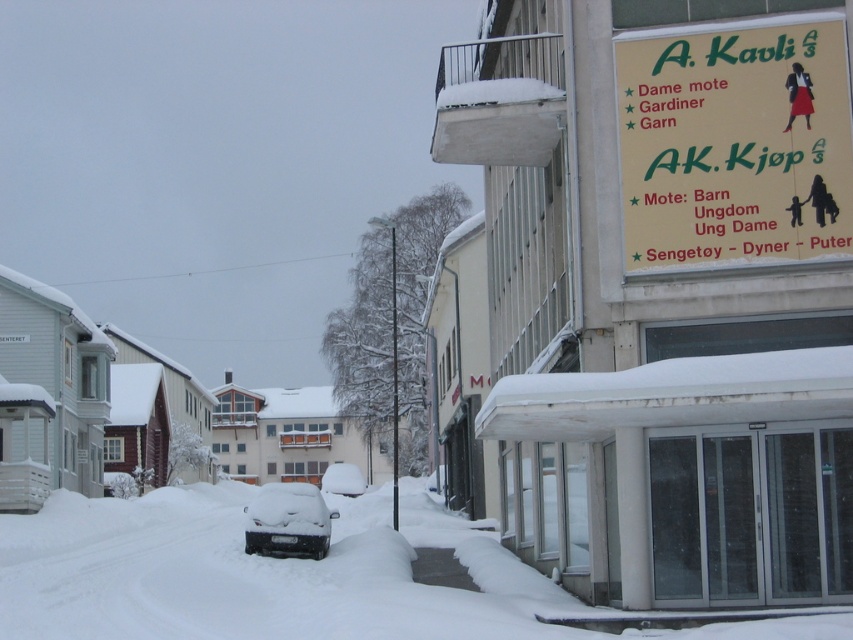
Question: Is yellow paper sign at upper right in front of snow-covered car at center?

Choices:
 (A) no
 (B) yes

Answer: (B)

Question: Among these objects, which one is nearest to the camera?

Choices:
 (A) snow-covered car at center
 (B) yellow paper sign at upper right

Answer: (B)

Question: Does yellow paper sign at upper right have a larger size compared to snow-covered car at center?

Choices:
 (A) no
 (B) yes

Answer: (A)

Question: Among these objects, which one is nearest to the camera?

Choices:
 (A) snow-covered car at center
 (B) yellow paper sign at upper right

Answer: (B)

Question: Can you confirm if yellow paper sign at upper right is positioned below snow-covered car at center?

Choices:
 (A) yes
 (B) no

Answer: (B)

Question: Which point is farther to the camera?

Choices:
 (A) (294, 483)
 (B) (816, 244)

Answer: (A)